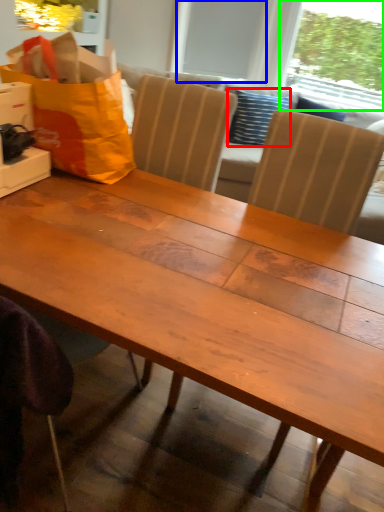
Question: Which object is the closest to the pillow (highlighted by a red box)? Choose among these: window screen (highlighted by a blue box) or window screen (highlighted by a green box).

Choices:
 (A) window screen
 (B) window screen

Answer: (A)